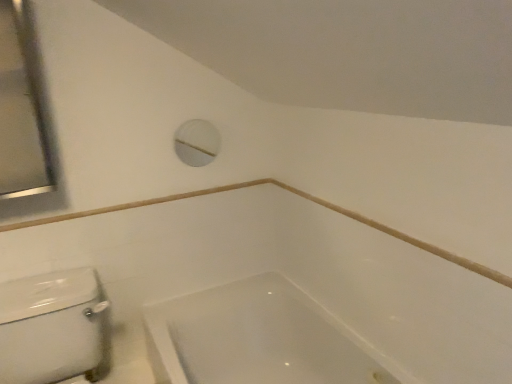
Question: From the image's perspective, is white glossy porcelain at lower left on top of white glossy bathtub at lower center?

Choices:
 (A) yes
 (B) no

Answer: (A)

Question: Is white glossy porcelain at lower left oriented away from white glossy bathtub at lower center?

Choices:
 (A) no
 (B) yes

Answer: (A)

Question: Would you say white glossy bathtub at lower center is part of white glossy porcelain at lower left's contents?

Choices:
 (A) yes
 (B) no

Answer: (B)

Question: Are white glossy porcelain at lower left and white glossy bathtub at lower center making contact?

Choices:
 (A) no
 (B) yes

Answer: (A)

Question: Can you confirm if white glossy porcelain at lower left is positioned to the right of white glossy bathtub at lower center?

Choices:
 (A) no
 (B) yes

Answer: (A)

Question: Is white glossy porcelain at lower left located outside white glossy bathtub at lower center?

Choices:
 (A) no
 (B) yes

Answer: (B)

Question: Is white glossy bathtub at lower center closer to camera compared to white glossy porcelain at lower left?

Choices:
 (A) no
 (B) yes

Answer: (A)

Question: Is white glossy porcelain at lower left located within white glossy bathtub at lower center?

Choices:
 (A) no
 (B) yes

Answer: (A)

Question: Is white glossy bathtub at lower center positioned beyond the bounds of white glossy porcelain at lower left?

Choices:
 (A) yes
 (B) no

Answer: (A)

Question: Considering the relative sizes of white glossy bathtub at lower center and white glossy porcelain at lower left in the image provided, is white glossy bathtub at lower center bigger than white glossy porcelain at lower left?

Choices:
 (A) yes
 (B) no

Answer: (A)

Question: Are white glossy bathtub at lower center and white glossy porcelain at lower left far apart?

Choices:
 (A) no
 (B) yes

Answer: (A)

Question: From the image's perspective, is white glossy bathtub at lower center on top of white glossy porcelain at lower left?

Choices:
 (A) no
 (B) yes

Answer: (A)

Question: Is white plastic porthole at upper center thinner than satin silver mirror at upper left?

Choices:
 (A) no
 (B) yes

Answer: (B)